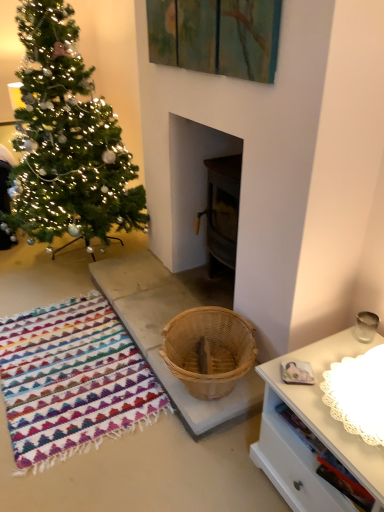
Question: Is natural wood basket at center beside green matte christmas tree at left?

Choices:
 (A) no
 (B) yes

Answer: (A)

Question: Does natural wood basket at center turn towards green matte christmas tree at left?

Choices:
 (A) yes
 (B) no

Answer: (B)

Question: Is natural wood basket at center not near green matte christmas tree at left?

Choices:
 (A) yes
 (B) no

Answer: (B)

Question: Is natural wood basket at center to the right of green matte christmas tree at left from the viewer's perspective?

Choices:
 (A) no
 (B) yes

Answer: (B)

Question: Is natural wood basket at center wider than green matte christmas tree at left?

Choices:
 (A) no
 (B) yes

Answer: (A)

Question: Relative to natural wood basket at center, is multicolored woven rug at lower left in front or behind?

Choices:
 (A) front
 (B) behind

Answer: (A)

Question: Is multicolored woven rug at lower left situated inside natural wood basket at center or outside?

Choices:
 (A) outside
 (B) inside

Answer: (A)

Question: From their relative heights in the image, would you say multicolored woven rug at lower left is taller or shorter than natural wood basket at center?

Choices:
 (A) tall
 (B) short

Answer: (B)

Question: In terms of width, does multicolored woven rug at lower left look wider or thinner when compared to natural wood basket at center?

Choices:
 (A) thin
 (B) wide

Answer: (B)

Question: From the image's perspective, is natural wood basket at center positioned above or below multicolored woven rug at lower left?

Choices:
 (A) below
 (B) above

Answer: (B)

Question: Is natural wood basket at center taller or shorter than multicolored woven rug at lower left?

Choices:
 (A) short
 (B) tall

Answer: (B)

Question: Is natural wood basket at center in front of or behind multicolored woven rug at lower left in the image?

Choices:
 (A) behind
 (B) front

Answer: (A)

Question: Is point (240, 386) closer or farther from the camera than point (94, 401)?

Choices:
 (A) farther
 (B) closer

Answer: (B)

Question: Based on their sizes in the image, would you say green matte christmas tree at left is bigger or smaller than multicolored woven rug at lower left?

Choices:
 (A) big
 (B) small

Answer: (A)

Question: Based on their positions, is green matte christmas tree at left located to the left or right of multicolored woven rug at lower left?

Choices:
 (A) right
 (B) left

Answer: (B)